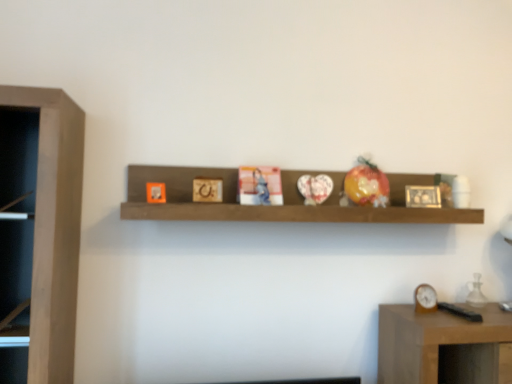
Where is `wooden picture frame at center`? This screenshot has height=384, width=512. wooden picture frame at center is located at coordinates (423, 196).

Is brown wooden shelf at center located within wooden picture frame at center?

No, brown wooden shelf at center is not surrounded by wooden picture frame at center.

Can you see wooden picture frame at center touching brown wooden shelf at center?

wooden picture frame at center is not next to brown wooden shelf at center, and they're not touching.

Based on their positions, is wooden picture frame at center located to the left or right of brown wooden shelf at center?

From the image, it's evident that wooden picture frame at center is to the right of brown wooden shelf at center.

Is point (425, 198) in front of point (436, 222)?

No.

Based on their positions, is brown wooden shelf at center located to the left or right of wooden picture frame at center?

From the image, it's evident that brown wooden shelf at center is to the left of wooden picture frame at center.

Is brown wooden shelf at center oriented away from wooden picture frame at center?

Correct, brown wooden shelf at center is looking away from wooden picture frame at center.

Are brown wooden shelf at center and wooden picture frame at center located far from each other?

No, there isn't a large distance between brown wooden shelf at center and wooden picture frame at center.

From the image's perspective, is brown wooden clock at right beneath wooden picture frame at center?

Indeed, from the image's perspective, brown wooden clock at right is shown beneath wooden picture frame at center.

Can you confirm if brown wooden clock at right is shorter than wooden picture frame at center?

Correct, brown wooden clock at right is not as tall as wooden picture frame at center.

From a real-world perspective, is brown wooden clock at right located higher than wooden picture frame at center?

No, from a real-world perspective, brown wooden clock at right is not above wooden picture frame at center.

Can you confirm if brown wooden clock at right is wider than wooden picture frame at center?

No.

Can you tell me how much brown wooden clock at right and brown wooden shelf at center differ in facing direction?

The facing directions of brown wooden clock at right and brown wooden shelf at center are 8.17 degrees apart.

Which object is positioned more to the left, brown wooden clock at right or brown wooden shelf at center?

Positioned to the left is brown wooden shelf at center.

From the image's perspective, is brown wooden clock at right above brown wooden shelf at center?

No.

Is brown wooden clock at right inside or outside of brown wooden shelf at center?

brown wooden clock at right is spatially situated outside brown wooden shelf at center.

Between wooden picture frame at center and brown wooden clock at right, which one is positioned behind?

wooden picture frame at center is more distant.

Is wooden picture frame at center wider or thinner than brown wooden clock at right?

Considering their sizes, wooden picture frame at center looks broader than brown wooden clock at right.

Considering the positions of objects wooden picture frame at center and brown wooden clock at right in the image provided, who is more to the left, wooden picture frame at center or brown wooden clock at right?

From the viewer's perspective, wooden picture frame at center appears more on the left side.

Does wooden picture frame at center have a lesser height compared to brown wooden clock at right?

No.

From a real-world perspective, is brown wooden shelf at center positioned above or below brown wooden clock at right?

Clearly, from a real-world perspective, brown wooden shelf at center is above brown wooden clock at right.

Is brown wooden shelf at center bigger than brown wooden clock at right?

Yes.

Does brown wooden shelf at center turn towards brown wooden clock at right?

No, brown wooden shelf at center is not facing towards brown wooden clock at right.

Is brown wooden shelf at center not inside brown wooden clock at right?

Absolutely, brown wooden shelf at center is external to brown wooden clock at right.

In the image, there is a wooden picture frame at center. Where is `shelf above it (from the image's perspective)`? The width and height of the screenshot is (512, 384). shelf above it (from the image's perspective) is located at coordinates (276, 206).

Locate an element on the screen. The height and width of the screenshot is (384, 512). shelf in front of the wooden picture frame at center is located at coordinates (276, 206).

Looking at the image, which one is located closer to brown wooden clock at right, brown wooden shelf at center or wooden picture frame at center?

Based on the image, wooden picture frame at center appears to be nearer to brown wooden clock at right.

Considering their positions, is wooden picture frame at center positioned further to brown wooden shelf at center than brown wooden clock at right?

brown wooden clock at right.

Which object lies nearer to the anchor point brown wooden shelf at center, brown wooden clock at right or wooden picture frame at center?

wooden picture frame at center is positioned closer to the anchor brown wooden shelf at center.

Estimate the real-world distances between objects in this image. Which object is further from wooden picture frame at center, brown wooden clock at right or brown wooden shelf at center?

Among the two, brown wooden shelf at center is located further to wooden picture frame at center.

Considering their positions, is brown wooden shelf at center positioned closer to wooden picture frame at center than brown wooden clock at right?

brown wooden clock at right is closer to wooden picture frame at center.

Estimate the real-world distances between objects in this image. Which object is further from brown wooden clock at right, wooden picture frame at center or brown wooden shelf at center?

brown wooden shelf at center lies further to brown wooden clock at right than the other object.

Locate an element on the screen. The image size is (512, 384). picture frame situated between brown wooden shelf at center and brown wooden clock at right from left to right is located at coordinates (423, 196).